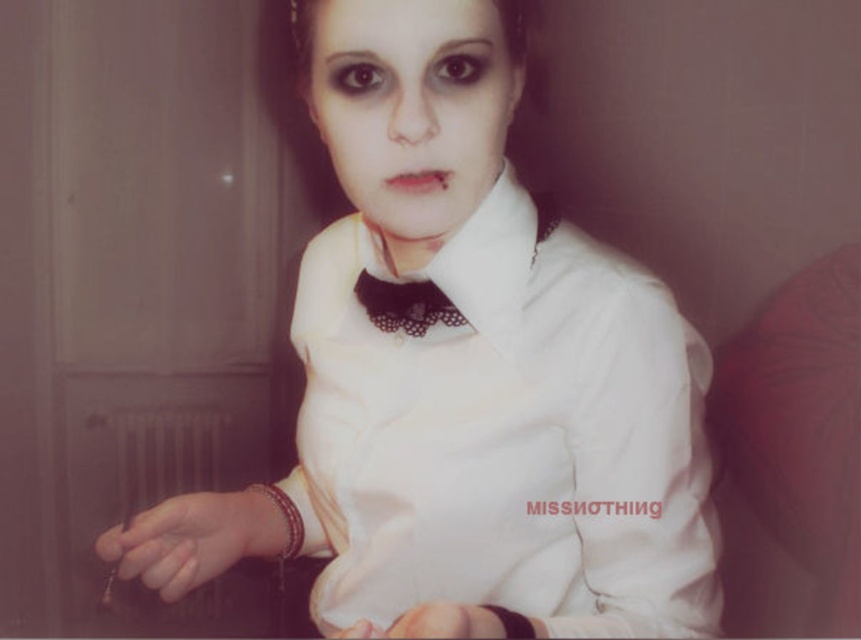
Question: Which of these objects is positioned farthest from the matte white face at center?

Choices:
 (A) black lace bow tie at center
 (B) satin-like brown bracelet at lower center

Answer: (B)

Question: Among these objects, which one is farthest from the camera?

Choices:
 (A) white satin shirt at center
 (B) satin-like brown bracelet at lower center
 (C) matte white face at center

Answer: (A)

Question: Does white satin shirt at center have a lesser width compared to matte white face at center?

Choices:
 (A) no
 (B) yes

Answer: (A)

Question: Is white satin shirt at center smaller than satin-like brown bracelet at lower center?

Choices:
 (A) no
 (B) yes

Answer: (A)

Question: Does white satin shirt at center have a smaller size compared to black lace bow tie at center?

Choices:
 (A) yes
 (B) no

Answer: (B)

Question: Which object is the closest to the matte white face at center?

Choices:
 (A) white satin shirt at center
 (B) black lace bow tie at center
 (C) satin-like brown bracelet at lower center

Answer: (B)